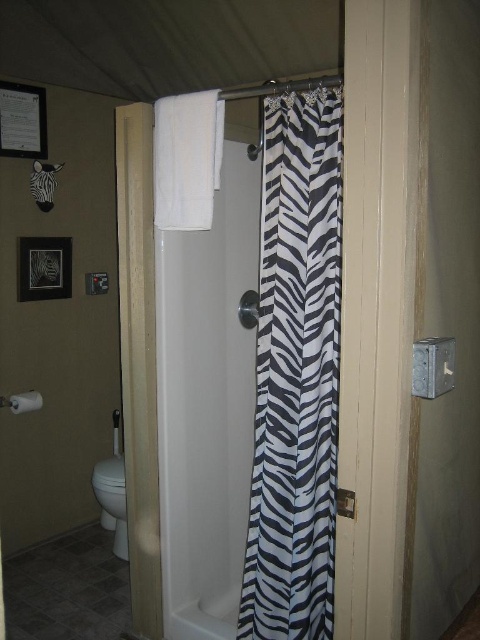
Question: Can you confirm if zebra-patterned fabric at center is wider than white matte towel bar at upper center?

Choices:
 (A) yes
 (B) no

Answer: (A)

Question: Among these points, which one is farthest from the camera?

Choices:
 (A) (25, 408)
 (B) (331, 170)
 (C) (103, 477)

Answer: (C)

Question: Does zebra-patterned fabric at center have a larger size compared to white glossy toilet bowl at lower left?

Choices:
 (A) no
 (B) yes

Answer: (B)

Question: Which of the following is the farthest from the observer?

Choices:
 (A) (301, 193)
 (B) (38, 394)

Answer: (B)

Question: Which of the following is the farthest from the observer?

Choices:
 (A) [x=269, y=116]
 (B) [x=15, y=408]
 (C) [x=117, y=529]

Answer: (C)

Question: Where is zebra-patterned fabric at center located in relation to white matte towel bar at upper center in the image?

Choices:
 (A) above
 (B) below

Answer: (A)